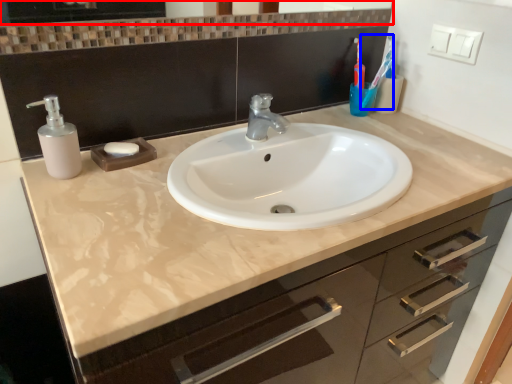
Question: Which point is closer to the camera, mirror (highlighted by a red box) or toothbrush (highlighted by a blue box)?

Choices:
 (A) mirror
 (B) toothbrush

Answer: (A)